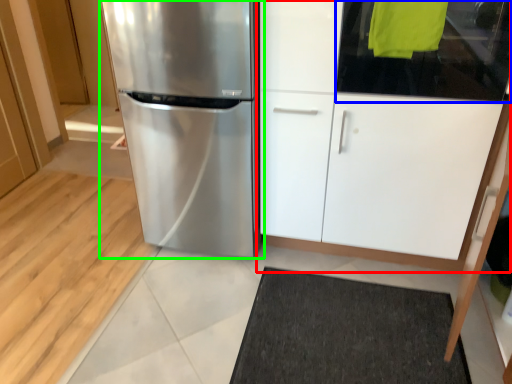
Question: Considering the real-world distances, which object is farthest from cabinetry (highlighted by a red box)? glass door (highlighted by a blue box) or refrigerator (highlighted by a green box)?

Choices:
 (A) glass door
 (B) refrigerator

Answer: (B)